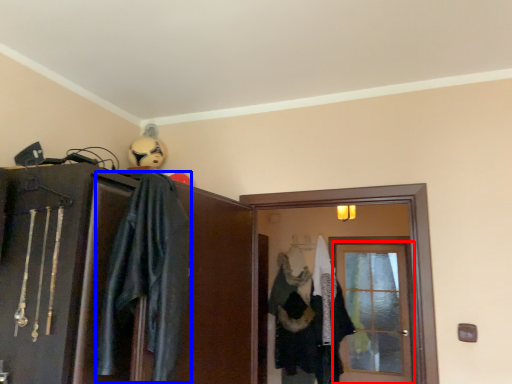
Question: Which point is further to the camera, door (highlighted by a red box) or costume (highlighted by a blue box)?

Choices:
 (A) door
 (B) costume

Answer: (A)